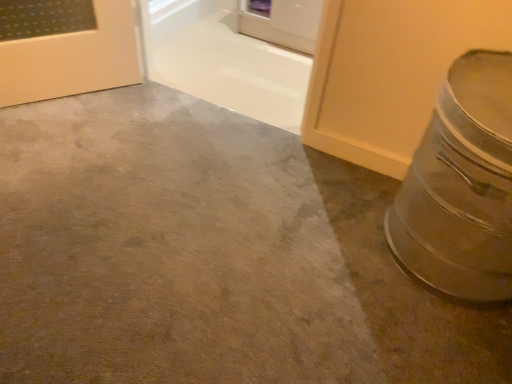
Question: Is silver metallic crock pot at right taller than smooth concrete at lower right?

Choices:
 (A) no
 (B) yes

Answer: (B)

Question: Is silver metallic crock pot at right not close to smooth concrete at lower right?

Choices:
 (A) yes
 (B) no

Answer: (B)

Question: Does silver metallic crock pot at right have a lesser height compared to smooth concrete at lower right?

Choices:
 (A) yes
 (B) no

Answer: (B)

Question: Could you tell me if silver metallic crock pot at right is turned towards smooth concrete at lower right?

Choices:
 (A) no
 (B) yes

Answer: (A)

Question: From the image's perspective, is silver metallic crock pot at right over smooth concrete at lower right?

Choices:
 (A) yes
 (B) no

Answer: (A)

Question: From the image's perspective, does silver metallic crock pot at right appear lower than smooth concrete at lower right?

Choices:
 (A) no
 (B) yes

Answer: (A)

Question: Can you confirm if silver metallic crock pot at right is taller than white glossy door at upper center?

Choices:
 (A) yes
 (B) no

Answer: (A)

Question: Is silver metallic crock pot at right wider than white glossy door at upper center?

Choices:
 (A) no
 (B) yes

Answer: (B)

Question: From a real-world perspective, is silver metallic crock pot at right below white glossy door at upper center?

Choices:
 (A) yes
 (B) no

Answer: (B)

Question: From the image's perspective, would you say silver metallic crock pot at right is positioned over white glossy door at upper center?

Choices:
 (A) yes
 (B) no

Answer: (B)

Question: Can you confirm if silver metallic crock pot at right is thinner than white glossy door at upper center?

Choices:
 (A) no
 (B) yes

Answer: (A)

Question: From the image's perspective, is silver metallic crock pot at right beneath white glossy door at upper center?

Choices:
 (A) yes
 (B) no

Answer: (A)

Question: Is white glossy door at upper center positioned beyond the bounds of silver metallic crock pot at right?

Choices:
 (A) no
 (B) yes

Answer: (B)